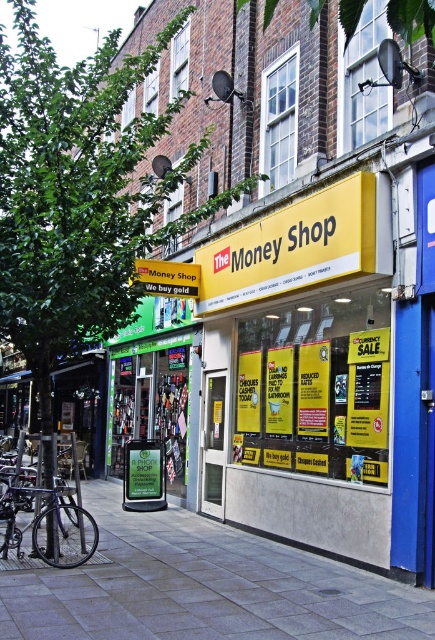
Is point (294, 284) positioned behind point (91, 516)?

Yes, point (294, 284) is farther from viewer.

Is yellow matte sign at center in front of black matte bicycle at lower left?

That is False.

Between point (291, 230) and point (30, 502), which one is positioned behind?

Point (291, 230)

Identify the location of yellow matte sign at center. The image size is (435, 640). (293, 248).

Can you confirm if green leafy tree at upper left is thinner than gray concrete pavement at lower center?

Incorrect, green leafy tree at upper left's width is not less than gray concrete pavement at lower center's.

Looking at this image, who is more forward, (107, 317) or (23, 596)?

Point (23, 596) is more forward.

Where is `green leafy tree at upper left`? The height and width of the screenshot is (640, 435). green leafy tree at upper left is located at coordinates (79, 196).

Can you confirm if green leafy tree at upper left is wider than black matte bicycle at lower left?

Correct, the width of green leafy tree at upper left exceeds that of black matte bicycle at lower left.

Who is more forward, (161, 134) or (79, 561)?

Point (79, 561) is in front.

You are a GUI agent. You are given a task and a screenshot of the screen. Output one action in this format:
    pyautogui.click(x=<x>, y=<y>)
    Task: Click on the green leafy tree at upper left
    This screenshot has width=435, height=640.
    Given the screenshot: What is the action you would take?
    pyautogui.click(x=79, y=196)